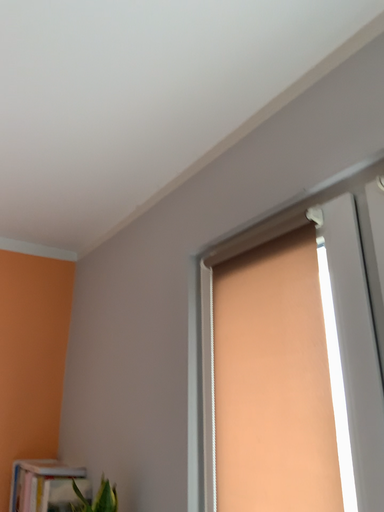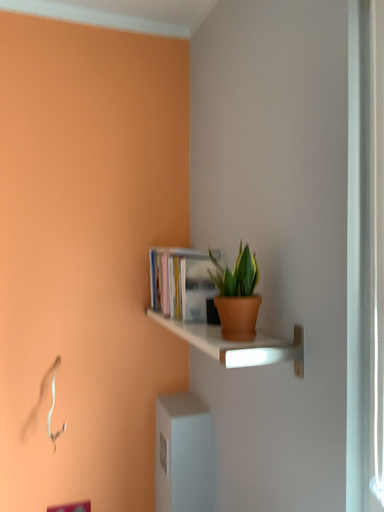
Question: How did the camera likely rotate when shooting the video?

Choices:
 (A) rotated left
 (B) rotated right

Answer: (A)